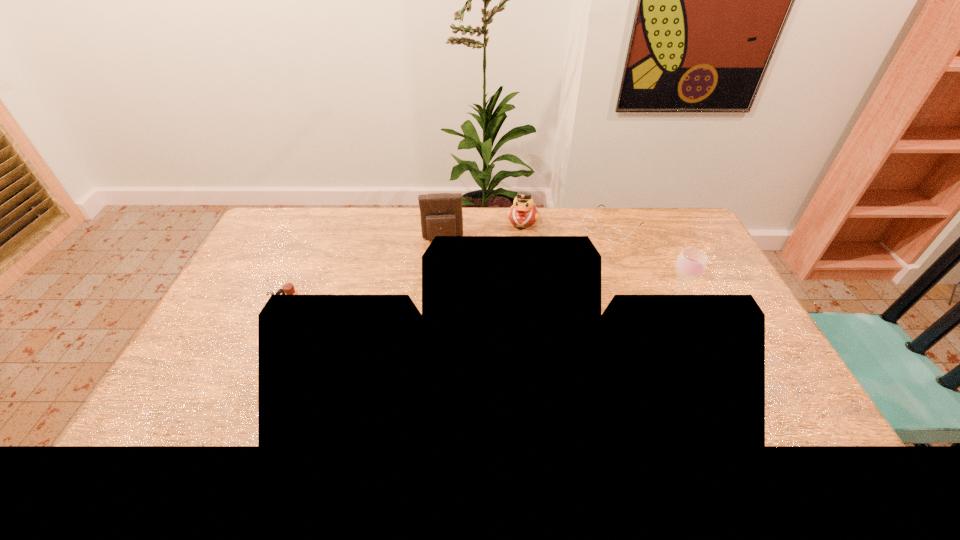
The image size is (960, 540). Identify the location of blank area located with an open flap on the pouch. (445, 278).

The image size is (960, 540). Find the location of `free region located with an open flap on the pouch`. free region located with an open flap on the pouch is located at coordinates (447, 311).

The image size is (960, 540). Identify the location of free space located on the face of the duck. (516, 254).

You are a GUI agent. You are given a task and a screenshot of the screen. Output one action in this format:
    pyautogui.click(x=<x>, y=<y>)
    Task: Click on the vacant region located 0.100m on the face of the duck
    
    Given the screenshot: What is the action you would take?
    pyautogui.click(x=517, y=247)

The image size is (960, 540). Find the location of `vacant space located on the face of the duck`. vacant space located on the face of the duck is located at coordinates (508, 291).

Locate an element on the screen. vacant region located on the front-facing side of the spectacles is located at coordinates (575, 260).

Find the location of a particular element. The width and height of the screenshot is (960, 540). free spot located on the front-facing side of the spectacles is located at coordinates (540, 291).

Find the location of a particular element. free space located on the front-facing side of the spectacles is located at coordinates (x=578, y=258).

The height and width of the screenshot is (540, 960). I want to click on pouch present at the far edge, so click(441, 214).

What are the coordinates of `duck that is at the far edge` in the screenshot? It's located at (523, 213).